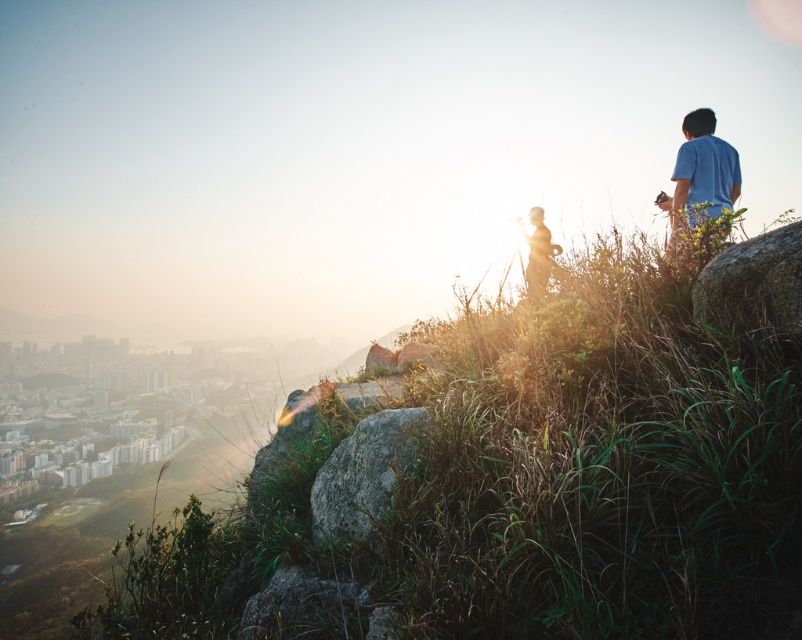
You are a photographer trying to capture a wide shot of the urban landscape. You notice the blue cotton shirt at right and the silhouette figure at center in your frame. Based on their positions, which object is more likely to block your view of the cityscape if they move closer to the camera?

The blue cotton shirt at right is wider than the silhouette figure at center, so if they move closer to the camera, the blue cotton shirt at right would more likely block the view of the cityscape due to its greater width.